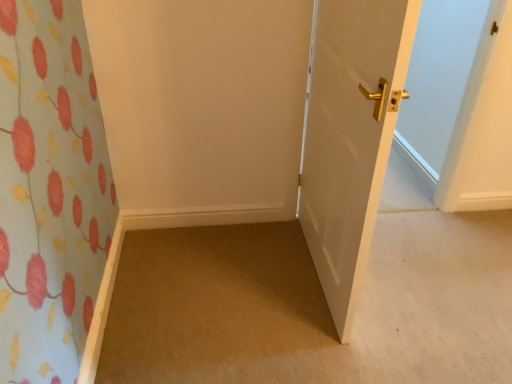
Question: Is carpet at lower left at the back of white glossy door at right?

Choices:
 (A) yes
 (B) no

Answer: (B)

Question: Is white glossy door at right at the left side of carpet at lower left?

Choices:
 (A) yes
 (B) no

Answer: (A)

Question: Can you confirm if white glossy door at right is smaller than carpet at lower left?

Choices:
 (A) yes
 (B) no

Answer: (B)

Question: Is white glossy door at right completely or partially outside of carpet at lower left?

Choices:
 (A) yes
 (B) no

Answer: (A)

Question: Considering the relative positions of white glossy door at right and carpet at lower left in the image provided, is white glossy door at right in front of carpet at lower left?

Choices:
 (A) no
 (B) yes

Answer: (B)

Question: Does white glossy door at right have a greater height compared to carpet at lower left?

Choices:
 (A) yes
 (B) no

Answer: (A)

Question: Considering the relative sizes of carpet at lower left and white glossy door at right in the image provided, is carpet at lower left shorter than white glossy door at right?

Choices:
 (A) no
 (B) yes

Answer: (B)

Question: Is carpet at lower left oriented away from white glossy door at right?

Choices:
 (A) no
 (B) yes

Answer: (A)

Question: Could you tell me if carpet at lower left is turned towards white glossy door at right?

Choices:
 (A) yes
 (B) no

Answer: (B)

Question: Considering the relative sizes of carpet at lower left and white glossy door at right in the image provided, is carpet at lower left smaller than white glossy door at right?

Choices:
 (A) yes
 (B) no

Answer: (A)

Question: Considering the relative sizes of carpet at lower left and white glossy door at right in the image provided, is carpet at lower left thinner than white glossy door at right?

Choices:
 (A) yes
 (B) no

Answer: (B)

Question: Is carpet at lower left at the right side of white glossy door at right?

Choices:
 (A) yes
 (B) no

Answer: (A)

Question: From a real-world perspective, relative to white glossy door at right, is carpet at lower left vertically above or below?

Choices:
 (A) below
 (B) above

Answer: (A)